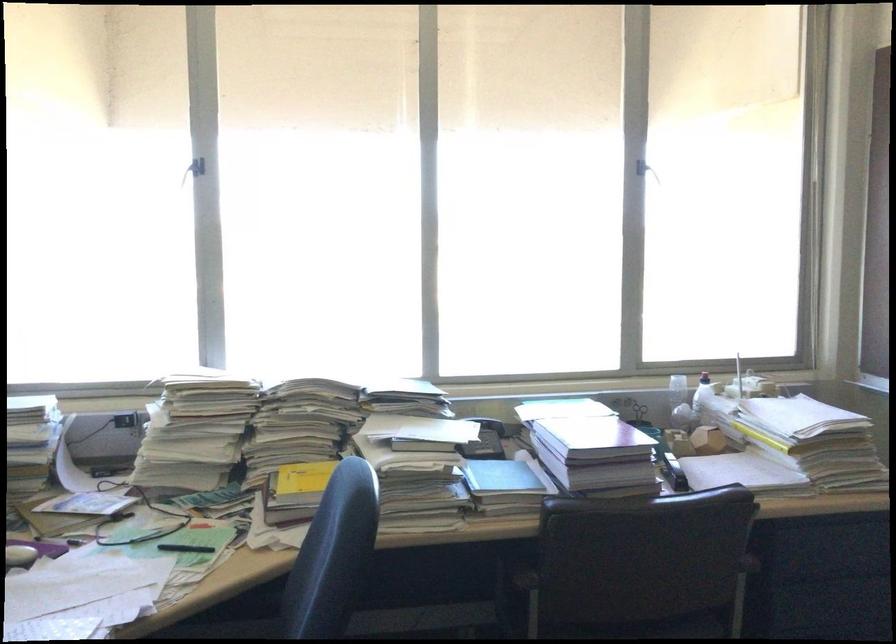
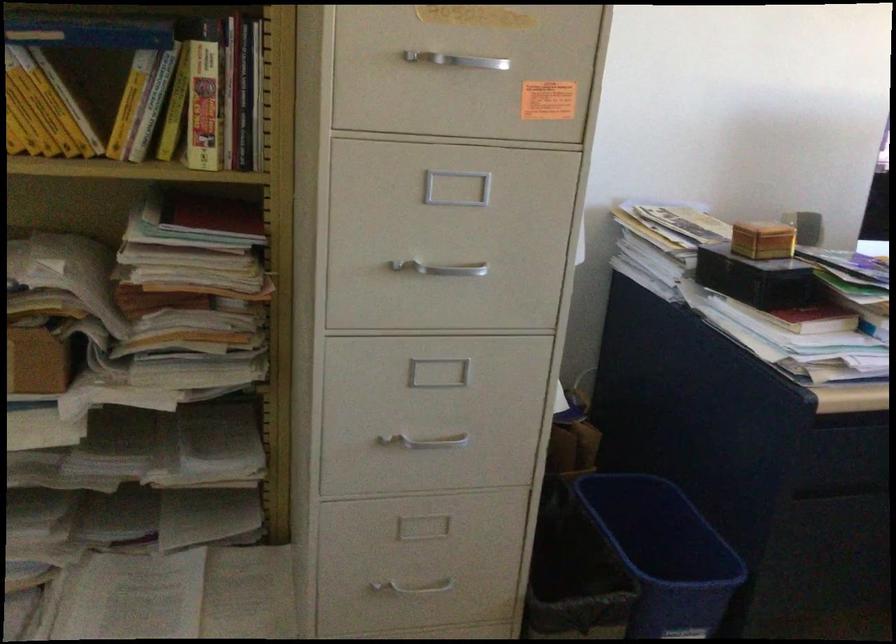
The first image is from the beginning of the video and the second image is from the end. How did the camera likely rotate when shooting the video?

The camera's rotation is toward left-down.